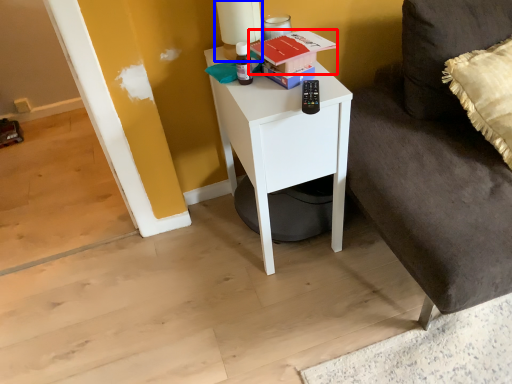
Question: Which object is closer to the camera taking this photo, book (highlighted by a red box) or table lamp (highlighted by a blue box)?

Choices:
 (A) book
 (B) table lamp

Answer: (A)